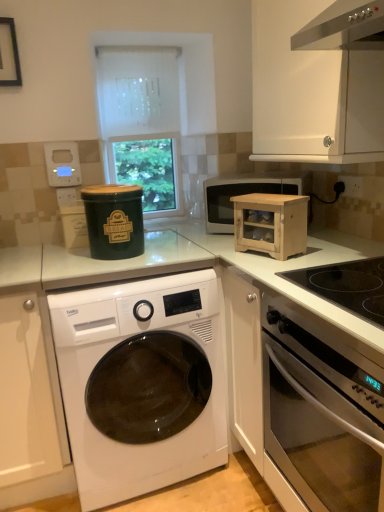
Question: In which direction should I rotate to look at white textured roller blind at upper center?

Choices:
 (A) left
 (B) right

Answer: (A)

Question: Is white plastic thermostat at upper left, the 1th appliance when ordered from back to front, aimed at black glass cooktop at right?

Choices:
 (A) no
 (B) yes

Answer: (A)

Question: Is white plastic thermostat at upper left, the 2th appliance ordered from the bottom, at the right side of black glass cooktop at right?

Choices:
 (A) no
 (B) yes

Answer: (A)

Question: Are white plastic thermostat at upper left, which appears as the 1th appliance when viewed from the top, and black glass cooktop at right far apart?

Choices:
 (A) yes
 (B) no

Answer: (A)

Question: Is the position of white plastic thermostat at upper left, which appears as the 1th appliance when viewed from the top, less distant than that of black glass cooktop at right?

Choices:
 (A) no
 (B) yes

Answer: (A)

Question: Is white plastic thermostat at upper left, which ranks as the second appliance in right-to-left order, completely or partially outside of black glass cooktop at right?

Choices:
 (A) no
 (B) yes

Answer: (B)

Question: Is white plastic thermostat at upper left, the 2th appliance positioned from the front, to the left of black glass cooktop at right from the viewer's perspective?

Choices:
 (A) yes
 (B) no

Answer: (A)

Question: Considering the relative sizes of white matte cabinet at upper right, the 1th cabinetry in the top-to-bottom sequence, and white textured roller blind at upper center in the image provided, is white matte cabinet at upper right, the 1th cabinetry in the top-to-bottom sequence, taller than white textured roller blind at upper center?

Choices:
 (A) yes
 (B) no

Answer: (B)

Question: Is white matte cabinet at upper right, acting as the second cabinetry starting from the bottom, smaller than white textured roller blind at upper center?

Choices:
 (A) no
 (B) yes

Answer: (A)

Question: Is white matte cabinet at upper right, acting as the second cabinetry starting from the bottom, outside of white textured roller blind at upper center?

Choices:
 (A) yes
 (B) no

Answer: (A)

Question: Does white matte cabinet at upper right, acting as the second cabinetry starting from the bottom, have a greater width compared to white textured roller blind at upper center?

Choices:
 (A) no
 (B) yes

Answer: (B)

Question: Are white matte cabinet at upper right, the 1th cabinetry in the top-to-bottom sequence, and white textured roller blind at upper center making contact?

Choices:
 (A) yes
 (B) no

Answer: (B)

Question: Does white matte cabinet at upper right, positioned as the 2th cabinetry in left-to-right order, come behind white textured roller blind at upper center?

Choices:
 (A) no
 (B) yes

Answer: (A)

Question: Is white plastic electrical outlet at left, which is counted as the 2th electric outlet, starting from the right, far from black plastic electric outlet at upper right, which is counted as the first electric outlet, starting from the front?

Choices:
 (A) yes
 (B) no

Answer: (A)